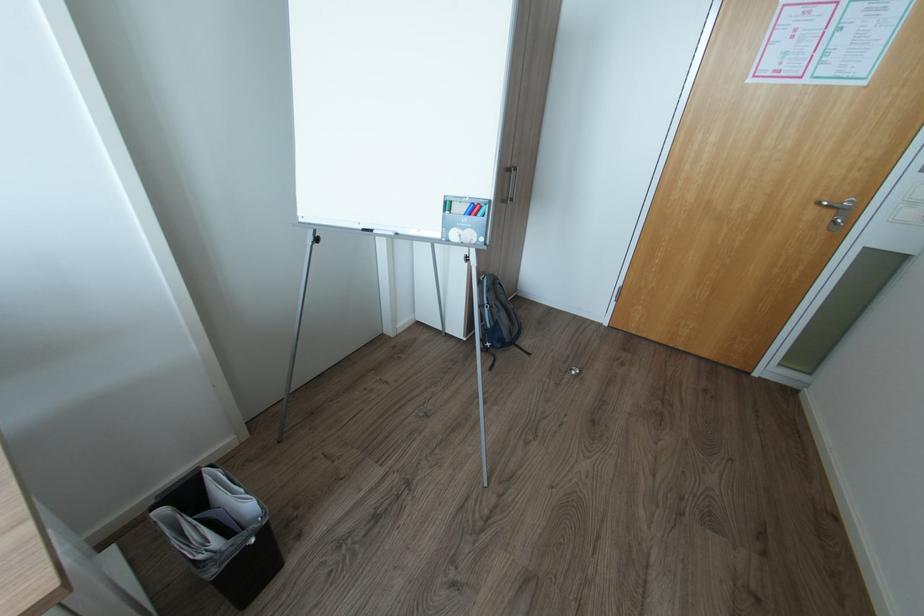
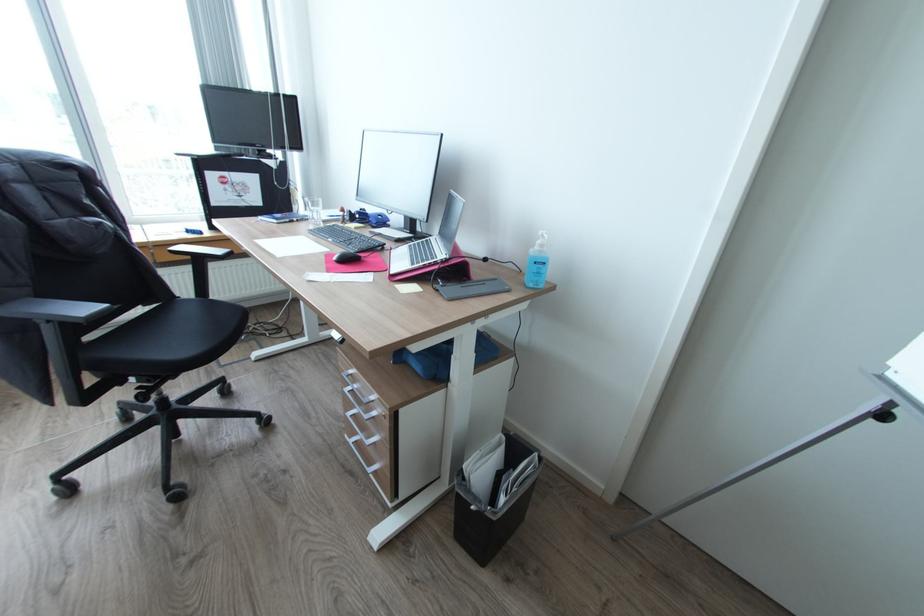
How did the camera likely rotate?

The camera rotated toward left-down.